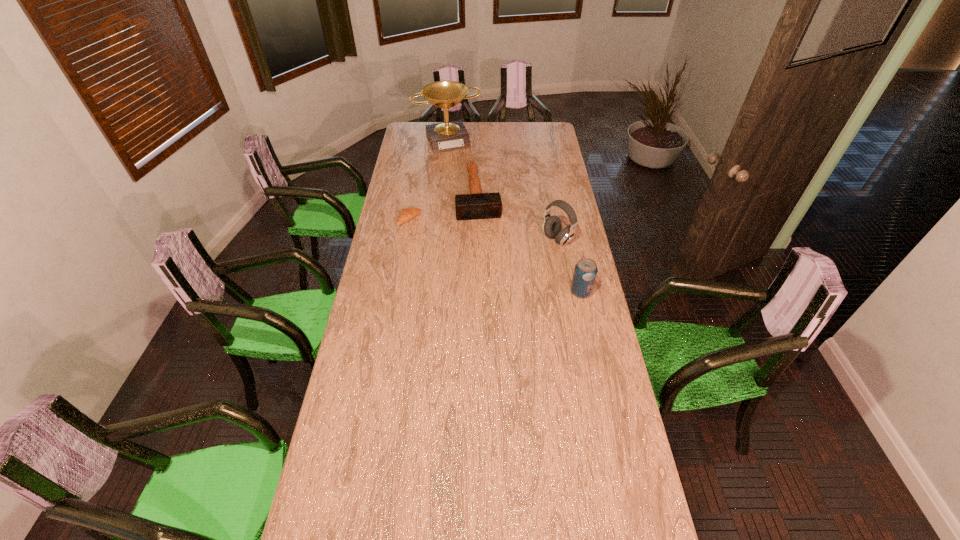
Identify the location of vacant region that satisfies the following two spatial constraints: 1. on the back side of the mallet; 2. on the right side of the shortest object. (414, 195).

At what (x,y) coordinates should I click in order to perform the action: click on vacant space that satisfies the following two spatial constraints: 1. on the front side of the nearest object; 2. on the right side of the headset. Please return your answer as a coordinate pair (x, y). Looking at the image, I should click on (567, 292).

I want to click on free space in the image that satisfies the following two spatial constraints: 1. on the front side of the mallet; 2. on the right side of the nearest object, so click(478, 292).